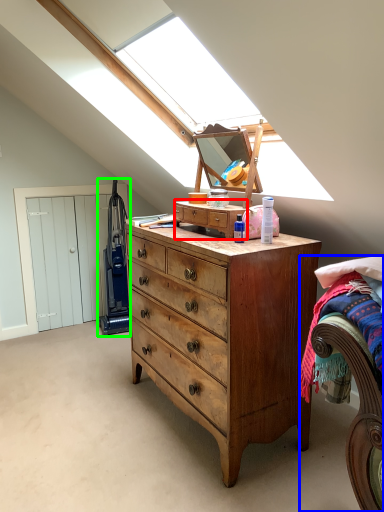
Question: Estimate the real-world distances between objects in this image. Which object is farther from cabinetry (highlighted by a red box), bed (highlighted by a blue box) or equipment (highlighted by a green box)?

Choices:
 (A) bed
 (B) equipment

Answer: (B)